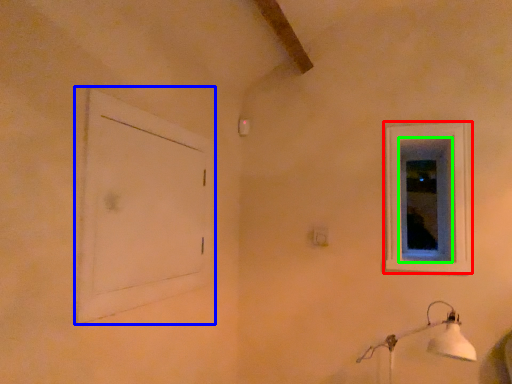
Question: Estimate the real-world distances between objects in this image. Which object is farther from window (highlighted by a red box), window frame (highlighted by a blue box) or window screen (highlighted by a green box)?

Choices:
 (A) window frame
 (B) window screen

Answer: (A)